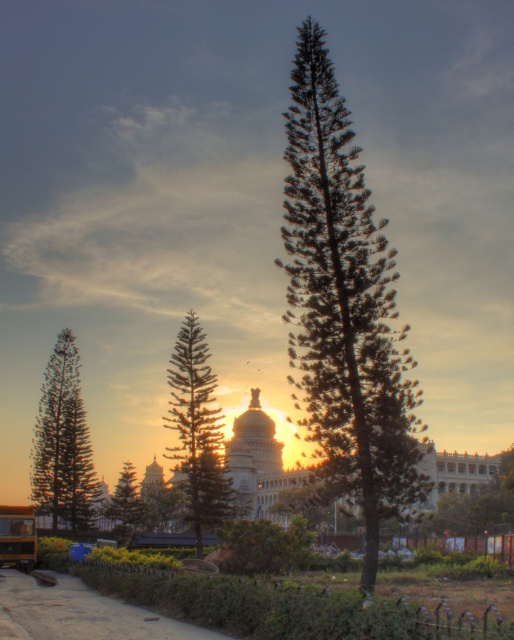
Does green needle-like at center appear over yellow matte school bus at lower left?

Indeed, green needle-like at center is positioned over yellow matte school bus at lower left.

Is green needle-like at center positioned at the back of yellow matte school bus at lower left?

No, green needle-like at center is in front of yellow matte school bus at lower left.

Which is in front, point (399, 387) or point (7, 548)?

Point (399, 387)

I want to click on green needle-like at center, so click(x=343, y=307).

Between point (316, 150) and point (131, 515), which one is positioned in front?

Positioned in front is point (316, 150).

Which is behind, point (343, 214) or point (113, 499)?

Positioned behind is point (113, 499).

Is point (352, 195) closer to camera compared to point (132, 488)?

Yes, point (352, 195) is in front of point (132, 488).

At what (x,y) coordinates should I click in order to perform the action: click on green needle-like at center. Please return your answer as a coordinate pair (x, y). This screenshot has width=514, height=640. Looking at the image, I should click on click(343, 307).

Is green needle-like tree at left thinner than yellow matte school bus at lower left?

No.

Who is positioned more to the right, green needle-like tree at left or yellow matte school bus at lower left?

yellow matte school bus at lower left is more to the right.

Does point (60, 396) lie in front of point (16, 532)?

No, (60, 396) is further to viewer.

Where is `green needle-like tree at left`? This screenshot has height=640, width=514. green needle-like tree at left is located at coordinates (63, 442).